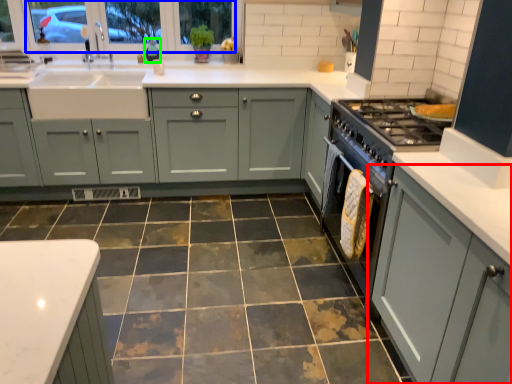
Question: Estimate the real-world distances between objects in this image. Which object is farther from cabinetry (highlighted by a red box), window screen (highlighted by a blue box) or teal (highlighted by a green box)?

Choices:
 (A) window screen
 (B) teal

Answer: (B)